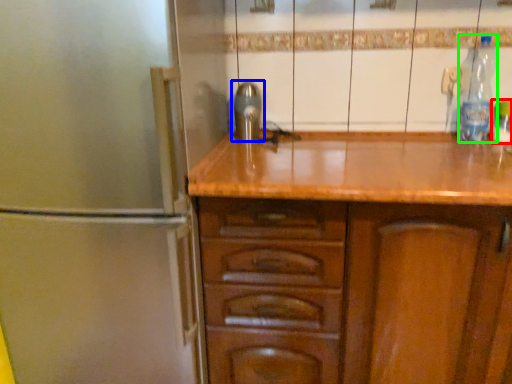
Question: Which object is the closest to the bottle (highlighted by a red box)? Choose among these: tap (highlighted by a blue box) or bottle (highlighted by a green box).

Choices:
 (A) tap
 (B) bottle

Answer: (B)